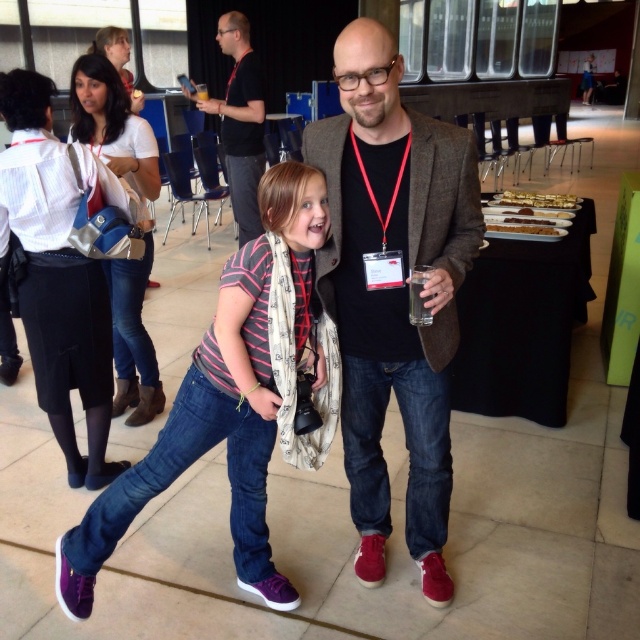
Question: Is purple suede shoes at lower left below denim jeans at left?

Choices:
 (A) yes
 (B) no

Answer: (A)

Question: Does brown woolen jacket at center appear on the right side of denim jeans at left?

Choices:
 (A) no
 (B) yes

Answer: (B)

Question: Which of the following is the closest to the observer?

Choices:
 (A) (118, 154)
 (B) (256, 205)
 (C) (268, 412)

Answer: (C)

Question: Which of the following is the closest to the observer?

Choices:
 (A) purple suede shoes at lower left
 (B) black cotton shirt at upper center
 (C) brown woolen jacket at center

Answer: (C)

Question: From the image, what is the correct spatial relationship of denim jeans at left in relation to black cotton shirt at upper center?

Choices:
 (A) left
 (B) right

Answer: (A)

Question: Which of the following is the farthest from the observer?

Choices:
 (A) (250, 163)
 (B) (337, 147)
 (C) (150, 449)
 (D) (129, 172)

Answer: (A)